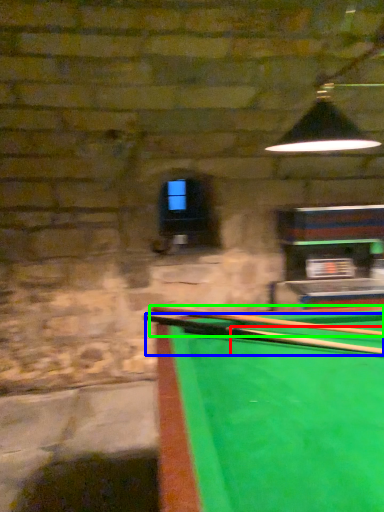
Question: Based on their relative distances, which object is nearer to cue (highlighted by a red box)? Choose from cue (highlighted by a blue box) and cue (highlighted by a green box).

Choices:
 (A) cue
 (B) cue

Answer: (A)